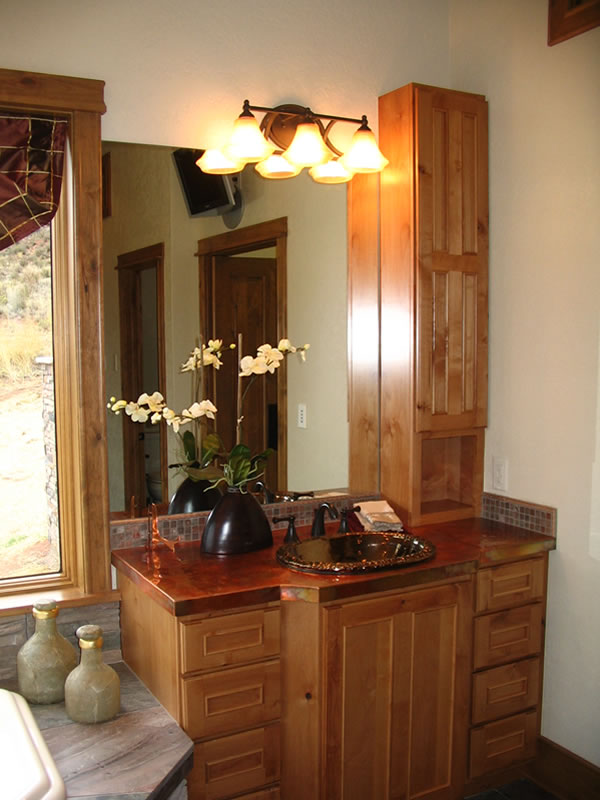
You are a GUI agent. You are given a task and a screenshot of the screen. Output one action in this format:
    pyautogui.click(x=<x>, y=<y>)
    Task: Click on the decorative tiling
    
    Given the screenshot: What is the action you would take?
    pyautogui.click(x=186, y=525), pyautogui.click(x=519, y=520)